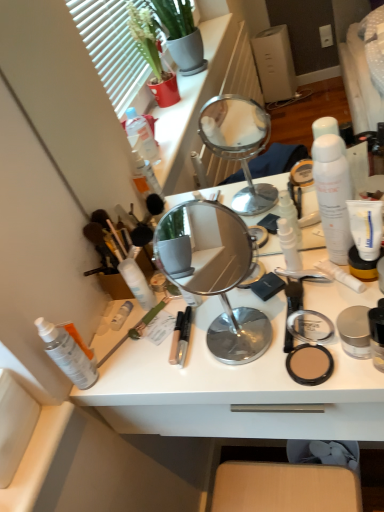
Image resolution: width=384 pixels, height=512 pixels. Find the location of `vacant space in between polished silver mirror at center and white matte lotion at center, which is counted as the 4th toiletry, starting from the right`. vacant space in between polished silver mirror at center and white matte lotion at center, which is counted as the 4th toiletry, starting from the right is located at coordinates (177, 328).